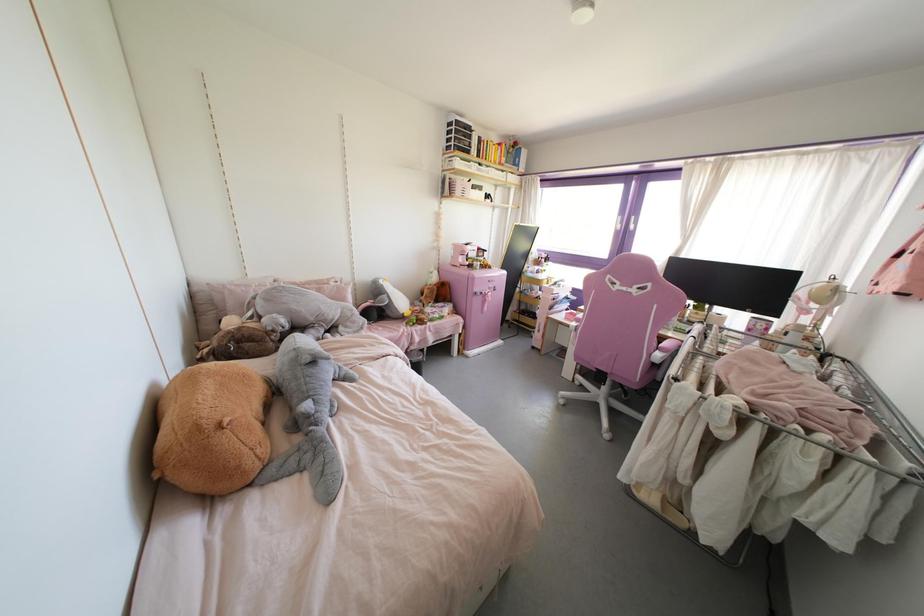
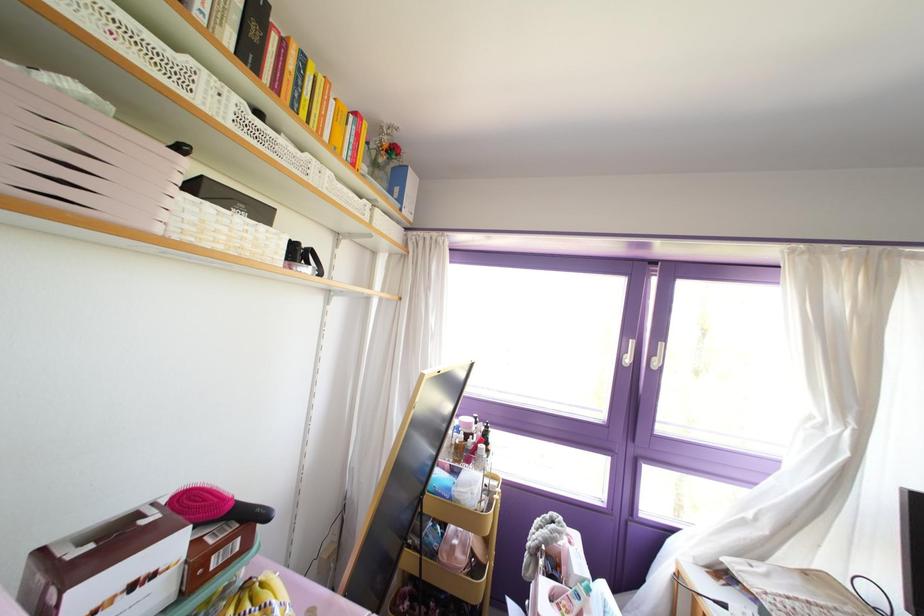
Where in the second image is the point corresponding to point 506,152 from the first image?

(372, 163)